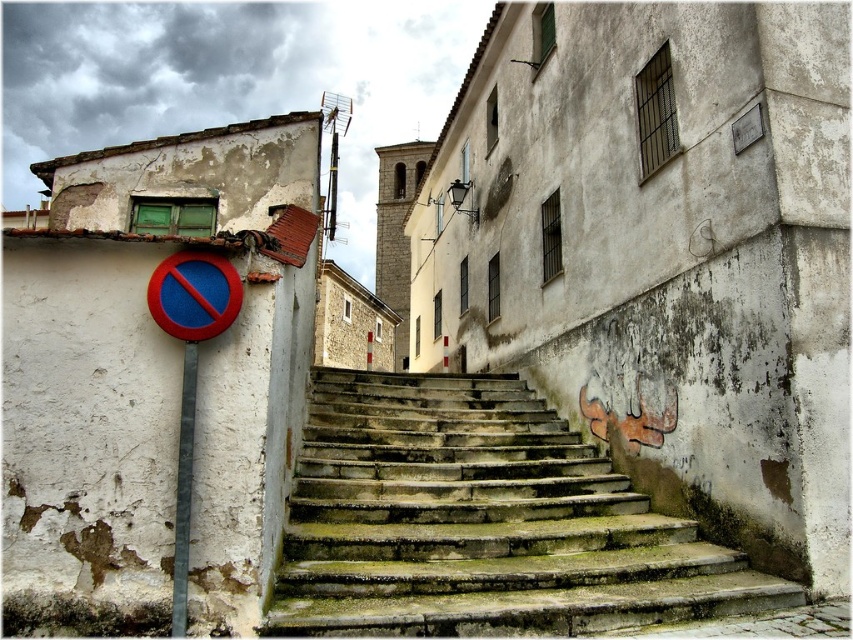
Question: Which point is closer to the camera?

Choices:
 (A) (376, 602)
 (B) (171, 628)

Answer: (B)

Question: Among these objects, which one is farthest from the camera?

Choices:
 (A) green mossy concrete stairs at center
 (B) gray metallic pole at left

Answer: (A)

Question: Which point appears closest to the camera in this image?

Choices:
 (A) (175, 566)
 (B) (694, 536)

Answer: (A)

Question: In this image, where is green mossy concrete stairs at center located relative to gray metallic pole at left?

Choices:
 (A) right
 (B) left

Answer: (A)

Question: In this image, where is green mossy concrete stairs at center located relative to gray metallic pole at left?

Choices:
 (A) below
 (B) above

Answer: (A)

Question: Is green mossy concrete stairs at center wider than gray metallic pole at left?

Choices:
 (A) no
 (B) yes

Answer: (B)